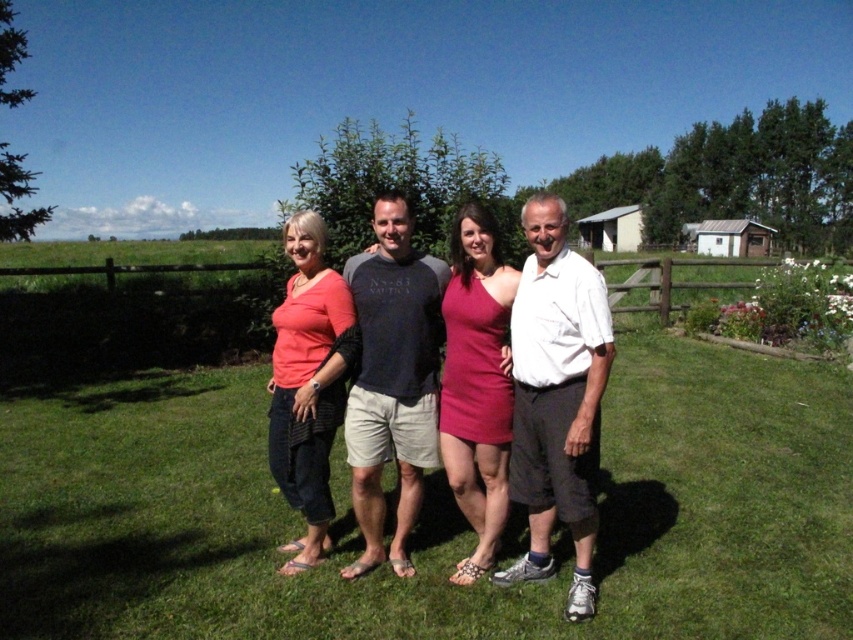
Question: Can you confirm if matte cotton t-shirt at center is positioned below matte pink dress at center?

Choices:
 (A) no
 (B) yes

Answer: (B)

Question: Does matte cotton t-shirt at center have a greater width compared to dark gray cotton t-shirt at center?

Choices:
 (A) yes
 (B) no

Answer: (A)

Question: Which of the following is the closest to the observer?

Choices:
 (A) matte pink dress at center
 (B) green grass at center

Answer: (B)

Question: Which of the following is the farthest from the observer?

Choices:
 (A) matte pink dress at center
 (B) dark gray cotton t-shirt at center
 (C) matte coral top at lower left
 (D) green grass at center

Answer: (B)

Question: Which point is farther from the camera taking this photo?

Choices:
 (A) (479, 308)
 (B) (755, 449)
 (C) (520, 378)
 (D) (323, 378)

Answer: (B)

Question: Can you confirm if dark gray cotton t-shirt at center is positioned to the right of matte coral top at lower left?

Choices:
 (A) no
 (B) yes

Answer: (B)